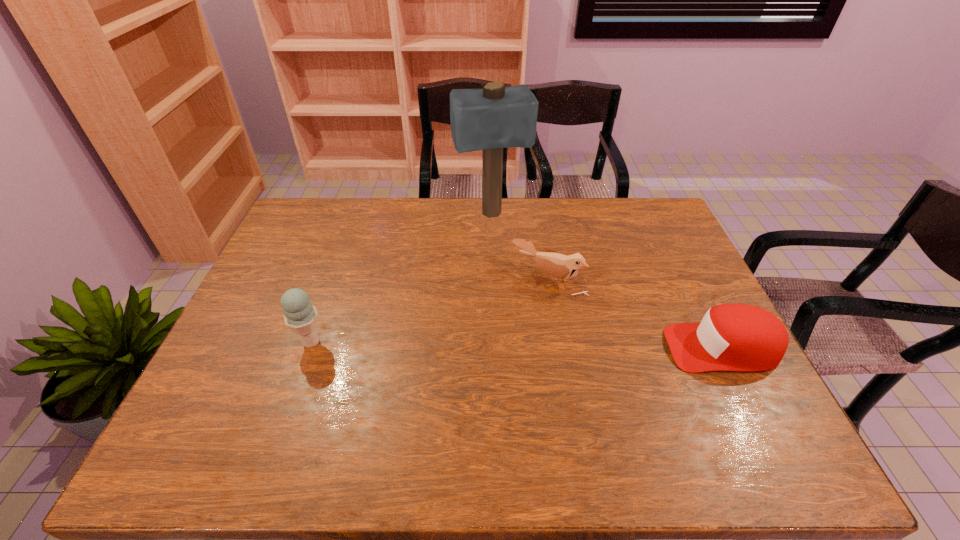
Identify the location of vacant area at the right edge of the desktop. (732, 372).

In order to click on vacant space at the far left corner of the desktop in this screenshot , I will do `click(321, 212)`.

At what (x,y) coordinates should I click in order to perform the action: click on free space at the near left corner. Please return your answer as a coordinate pair (x, y). The height and width of the screenshot is (540, 960). Looking at the image, I should click on (190, 412).

What are the coordinates of `vacant region at the far right corner` in the screenshot? It's located at (633, 200).

This screenshot has width=960, height=540. In order to click on free space at the near right corner of the desktop in this screenshot , I will do `click(694, 397)`.

What are the coordinates of `empty space that is in between the ice cream and the second farthest object` in the screenshot? It's located at (430, 310).

What are the coordinates of `vacant point located between the baseball cap and the farthest object` in the screenshot? It's located at (607, 281).

Locate an element on the screen. The height and width of the screenshot is (540, 960). vacant region between the baseball cap and the farthest object is located at coordinates (607, 281).

At what (x,y) coordinates should I click in order to perform the action: click on vacant area that lies between the leftmost object and the rightmost object. Please return your answer as a coordinate pair (x, y). The image size is (960, 540). Looking at the image, I should click on (516, 345).

I want to click on vacant space in between the rightmost object and the ice cream, so click(516, 345).